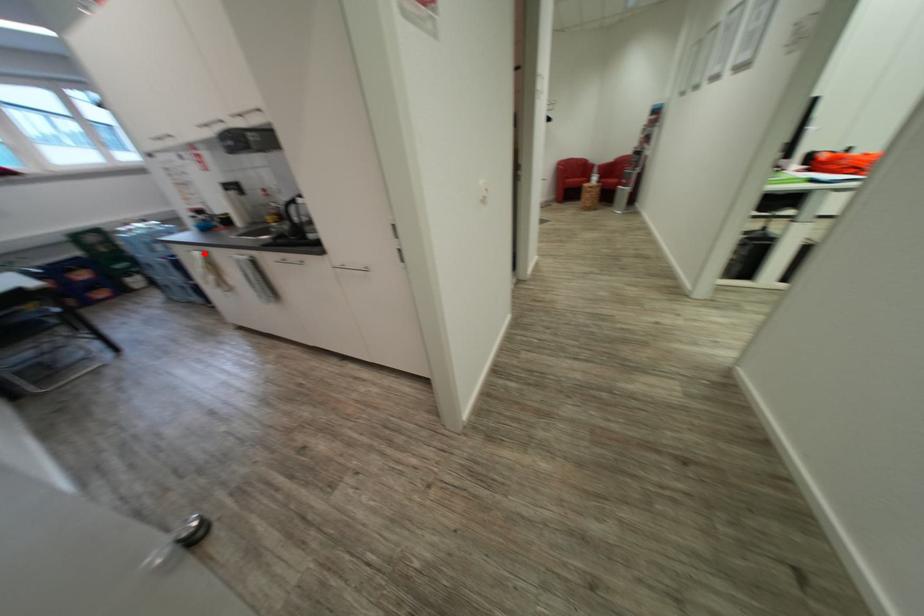
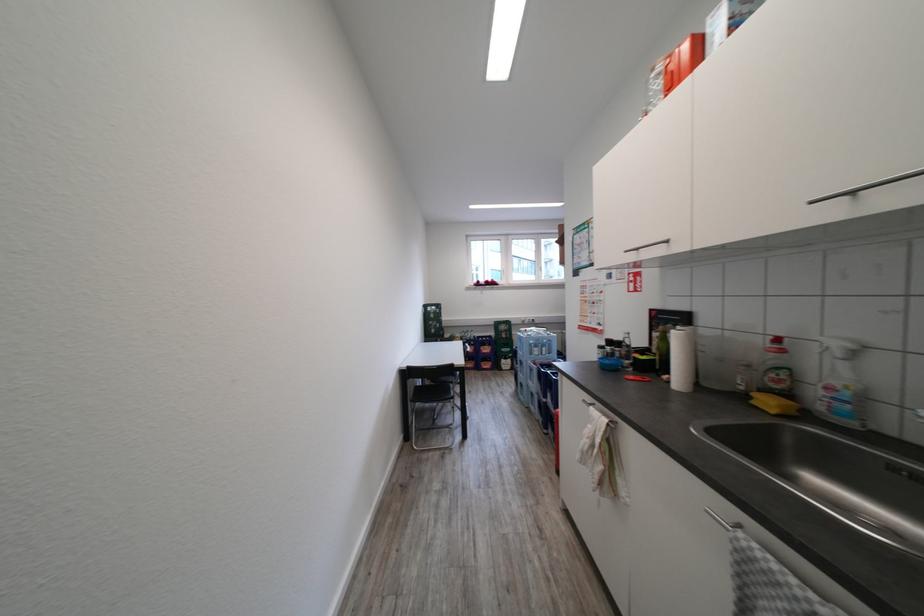
Locate, in the second image, the point that corresponds to the highlighted location in the first image.

(611, 426)